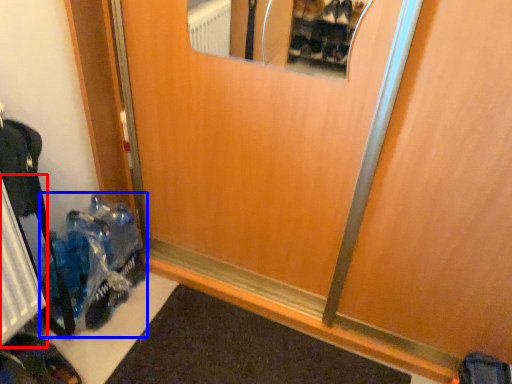
Question: Which point is closer to the camera, radiator (highlighted by a red box) or toy (highlighted by a blue box)?

Choices:
 (A) radiator
 (B) toy

Answer: (A)